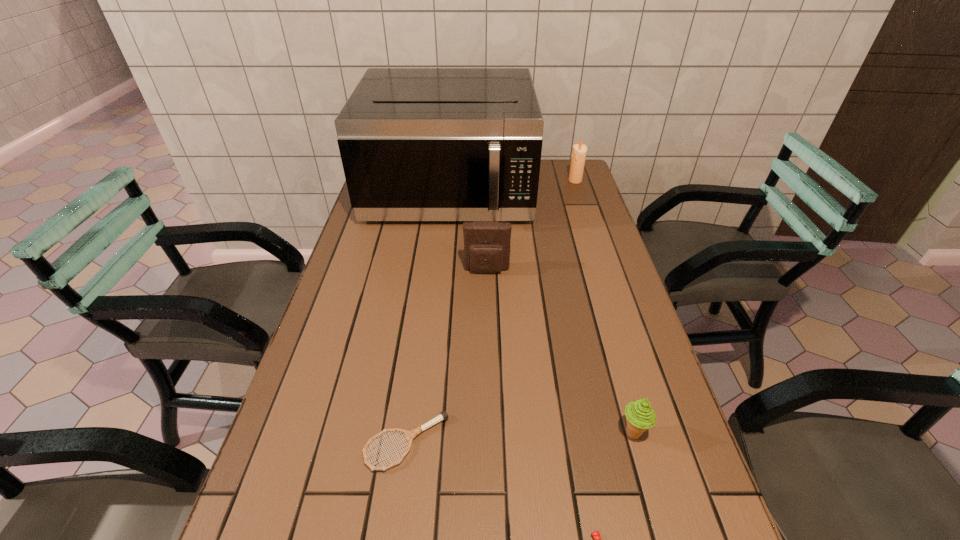
Where is `microwave_oven`? This screenshot has width=960, height=540. microwave_oven is located at coordinates (417, 144).

You are a GUI agent. You are given a task and a screenshot of the screen. Output one action in this format:
    pyautogui.click(x=<x>, y=<y>)
    Task: Click on the candle
    The image size is (960, 540).
    Given the screenshot: What is the action you would take?
    pyautogui.click(x=579, y=151)

The image size is (960, 540). I want to click on pouch, so click(x=486, y=243).

This screenshot has width=960, height=540. In order to click on the third shortest object in this screenshot , I will do `click(640, 416)`.

In order to click on the farther tennis racket in this screenshot , I will do `click(410, 435)`.

This screenshot has height=540, width=960. Identify the location of the taller tennis racket. point(410,435).

Locate an element on the screen. This screenshot has height=540, width=960. free space located 0.360m on the front-facing side of the tallest object is located at coordinates (436, 316).

Locate an element on the screen. The width and height of the screenshot is (960, 540). free space located 0.160m on the front of the candle is located at coordinates (584, 207).

Where is `free point located 0.270m with an open flap on the fourth nearest object`? This screenshot has height=540, width=960. free point located 0.270m with an open flap on the fourth nearest object is located at coordinates (488, 350).

Find the location of `vacant region located on the back of the icecream`. vacant region located on the back of the icecream is located at coordinates (594, 298).